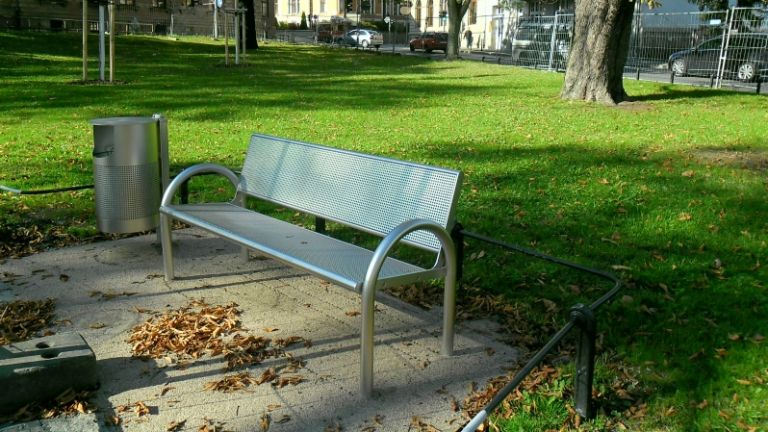
What are the coordinates of `bench` in the screenshot? It's located at (346, 202).